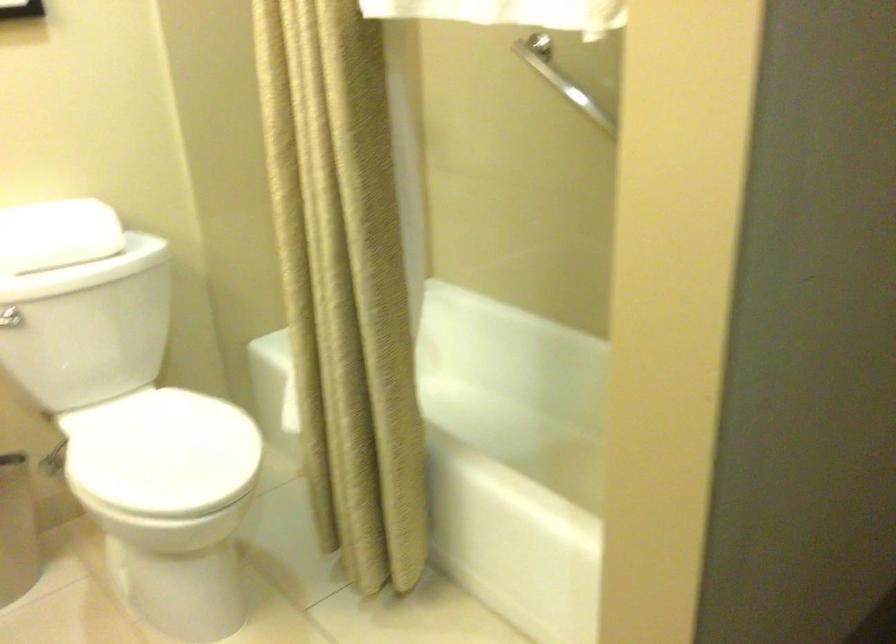
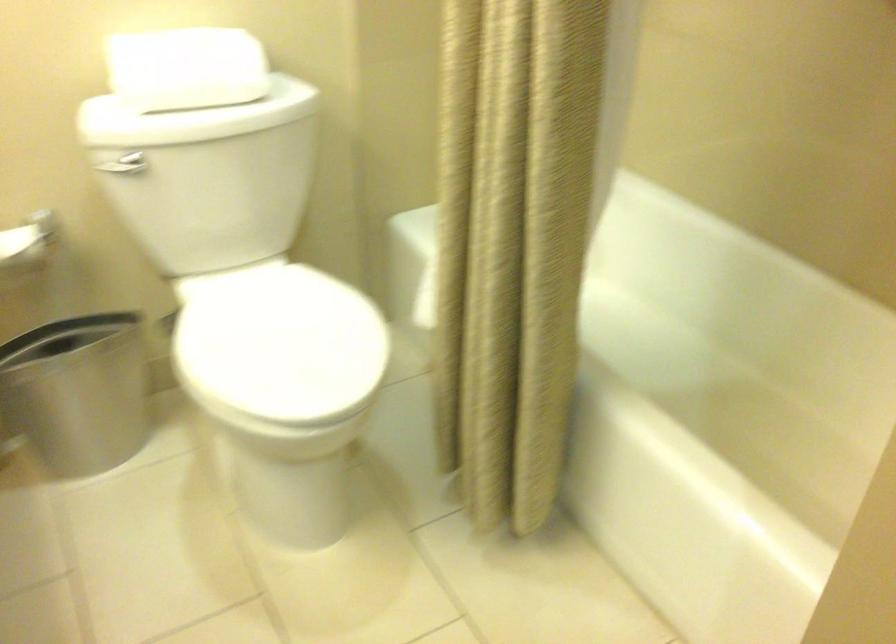
Question: What movement of the cameraman would produce the second image?

Choices:
 (A) Left
 (B) Right
 (C) Forward
 (D) Backward

Answer: (C)